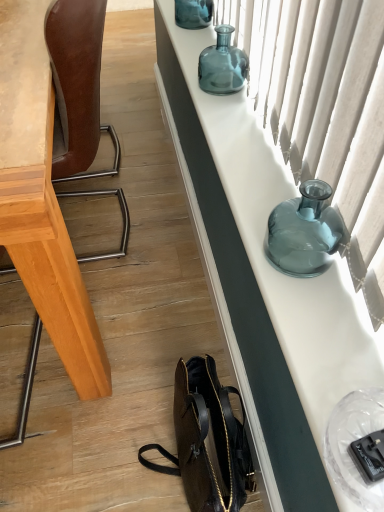
Find the location of a particular element. unoccupied area in front of teal glass vase at upper center, the 1th bottle in the top-to-bottom sequence is located at coordinates (201, 40).